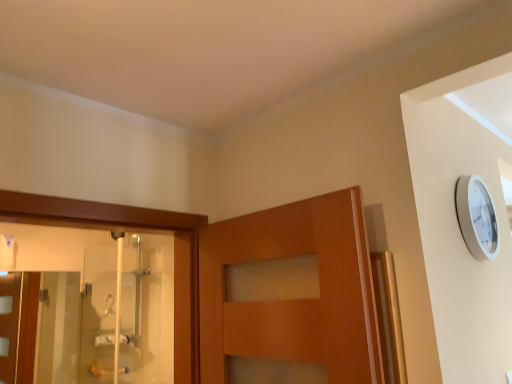
Identify the location of transparent glass screen door at left, which is the first screen door from left to right. (58, 328).

Measure the distance between point [77,356] and camera.

Point [77,356] is 9.65 feet from camera.

Describe the element at coordinates (58, 328) in the screenshot. I see `transparent glass screen door at left, which is the second screen door from right to left` at that location.

Locate an element on the screen. The image size is (512, 384). clear glass shower door at left, which is the first screen door from right to left is located at coordinates (109, 313).

This screenshot has width=512, height=384. Describe the element at coordinates (109, 313) in the screenshot. I see `clear glass shower door at left, the second screen door positioned from the left` at that location.

The image size is (512, 384). What are the coordinates of `transparent glass screen door at left, which is the first screen door from left to right` in the screenshot? It's located at (58, 328).

Is transparent glass screen door at left, which is the first screen door from left to right, to the right of clear glass shower door at left, the second screen door positioned from the left, from the viewer's perspective?

Incorrect, transparent glass screen door at left, which is the first screen door from left to right, is not on the right side of clear glass shower door at left, the second screen door positioned from the left.

Which object is further away from the camera taking this photo, transparent glass screen door at left, which is the first screen door from left to right, or clear glass shower door at left, which is the first screen door from right to left?

transparent glass screen door at left, which is the first screen door from left to right.

Considering the positions of point (72, 318) and point (85, 262), is point (72, 318) closer or farther from the camera than point (85, 262)?

Point (72, 318) appears to be farther away from the viewer than point (85, 262).

From the image's perspective, which is below, transparent glass screen door at left, which is the second screen door from right to left, or clear glass shower door at left, the second screen door positioned from the left?

transparent glass screen door at left, which is the second screen door from right to left, is shown below in the image.

From a real-world perspective, is transparent glass screen door at left, which is the second screen door from right to left, above or below clear glass shower door at left, the second screen door positioned from the left?

transparent glass screen door at left, which is the second screen door from right to left, is situated lower than clear glass shower door at left, the second screen door positioned from the left, in the real world.

Can you confirm if transparent glass screen door at left, which is the second screen door from right to left, is wider than clear glass shower door at left, which is the first screen door from right to left?

Yes.

Can you confirm if transparent glass screen door at left, which is the second screen door from right to left, is shorter than clear glass shower door at left, the second screen door positioned from the left?

Indeed, transparent glass screen door at left, which is the second screen door from right to left, has a lesser height compared to clear glass shower door at left, the second screen door positioned from the left.

Is transparent glass screen door at left, which is the first screen door from left to right, smaller than clear glass shower door at left, the second screen door positioned from the left?

No, transparent glass screen door at left, which is the first screen door from left to right, is not smaller than clear glass shower door at left, the second screen door positioned from the left.

Is clear glass shower door at left, the second screen door positioned from the left, completely or partially inside transparent glass screen door at left, which is the first screen door from left to right?

That's incorrect, clear glass shower door at left, the second screen door positioned from the left, is not inside transparent glass screen door at left, which is the first screen door from left to right.

Is transparent glass screen door at left, which is the second screen door from right to left, in contact with clear glass shower door at left, which is the first screen door from right to left?

No, transparent glass screen door at left, which is the second screen door from right to left, is not beside clear glass shower door at left, which is the first screen door from right to left.

Is transparent glass screen door at left, which is the second screen door from right to left, positioned with its back to clear glass shower door at left, the second screen door positioned from the left?

No, transparent glass screen door at left, which is the second screen door from right to left, is not facing away from clear glass shower door at left, the second screen door positioned from the left.

Can you tell me how much transparent glass screen door at left, which is the first screen door from left to right, and clear glass shower door at left, the second screen door positioned from the left, differ in facing direction?

The angle between the facing direction of transparent glass screen door at left, which is the first screen door from left to right, and the facing direction of clear glass shower door at left, the second screen door positioned from the left, is 89.9 degrees.

Where is `screen door on the left of clear glass shower door at left, which is the first screen door from right to left`? This screenshot has width=512, height=384. screen door on the left of clear glass shower door at left, which is the first screen door from right to left is located at coordinates (58, 328).

Which is more to the left, clear glass shower door at left, which is the first screen door from right to left, or transparent glass screen door at left, which is the first screen door from left to right?

From the viewer's perspective, transparent glass screen door at left, which is the first screen door from left to right, appears more on the left side.

In the image, is clear glass shower door at left, which is the first screen door from right to left, positioned in front of or behind transparent glass screen door at left, which is the second screen door from right to left?

clear glass shower door at left, which is the first screen door from right to left, is positioned closer to the viewer than transparent glass screen door at left, which is the second screen door from right to left.

Considering the positions of points (98, 273) and (60, 275), is point (98, 273) closer to camera compared to point (60, 275)?

Yes.

Looking at this image, from the image's perspective, which one is positioned lower, clear glass shower door at left, which is the first screen door from right to left, or transparent glass screen door at left, which is the first screen door from left to right?

transparent glass screen door at left, which is the first screen door from left to right, from the image's perspective.

From a real-world perspective, is clear glass shower door at left, which is the first screen door from right to left, located higher than transparent glass screen door at left, which is the second screen door from right to left?

Yes, from a real-world perspective, clear glass shower door at left, which is the first screen door from right to left, is over transparent glass screen door at left, which is the second screen door from right to left

Between clear glass shower door at left, the second screen door positioned from the left, and transparent glass screen door at left, which is the first screen door from left to right, which one has smaller width?

clear glass shower door at left, the second screen door positioned from the left.

Which of these two, clear glass shower door at left, which is the first screen door from right to left, or transparent glass screen door at left, which is the first screen door from left to right, stands shorter?

transparent glass screen door at left, which is the first screen door from left to right.

Considering the sizes of objects clear glass shower door at left, the second screen door positioned from the left, and transparent glass screen door at left, which is the second screen door from right to left, in the image provided, who is bigger, clear glass shower door at left, the second screen door positioned from the left, or transparent glass screen door at left, which is the second screen door from right to left,?

transparent glass screen door at left, which is the second screen door from right to left, is bigger.

Is clear glass shower door at left, the second screen door positioned from the left, situated inside transparent glass screen door at left, which is the first screen door from left to right, or outside?

clear glass shower door at left, the second screen door positioned from the left, is not enclosed by transparent glass screen door at left, which is the first screen door from left to right.

Is clear glass shower door at left, which is the first screen door from right to left, far from transparent glass screen door at left, which is the second screen door from right to left?

They are positioned close to each other.

Could you tell me if clear glass shower door at left, the second screen door positioned from the left, is turned towards transparent glass screen door at left, which is the second screen door from right to left?

Yes, clear glass shower door at left, the second screen door positioned from the left, is facing transparent glass screen door at left, which is the second screen door from right to left.

What's the angular difference between clear glass shower door at left, which is the first screen door from right to left, and transparent glass screen door at left, which is the first screen door from left to right,'s facing directions?

They differ by 89.9 degrees in their facing directions.

Where is `screen door in front of the transparent glass screen door at left, which is the second screen door from right to left`? This screenshot has height=384, width=512. screen door in front of the transparent glass screen door at left, which is the second screen door from right to left is located at coordinates (109, 313).

At what (x,y) coordinates should I click in order to perform the action: click on screen door lying behind the clear glass shower door at left, the second screen door positioned from the left. Please return your answer as a coordinate pair (x, y). Looking at the image, I should click on (58, 328).

At what (x,y) coordinates should I click in order to perform the action: click on screen door in front of the transparent glass screen door at left, which is the first screen door from left to right. Please return your answer as a coordinate pair (x, y). This screenshot has width=512, height=384. Looking at the image, I should click on (109, 313).